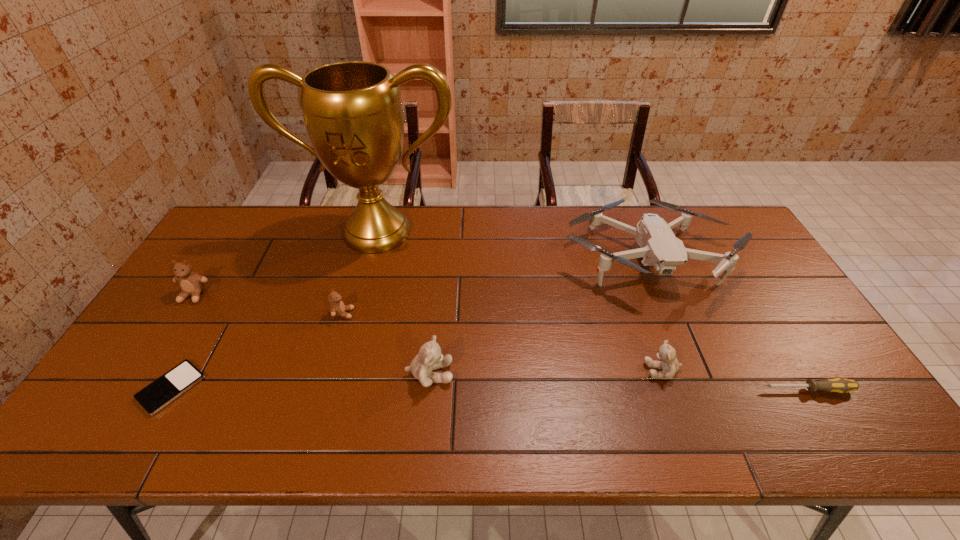
Where is `the smaller gray teddy bear`? The height and width of the screenshot is (540, 960). the smaller gray teddy bear is located at coordinates (667, 354).

Locate an element on the screen. The width and height of the screenshot is (960, 540). gray screwdriver is located at coordinates (840, 385).

Find the location of a particular element. screwdriver is located at coordinates (840, 385).

The image size is (960, 540). Identify the location of iPod. (164, 390).

Image resolution: width=960 pixels, height=540 pixels. I want to click on gray iPod, so click(164, 390).

You are a GUI agent. You are given a task and a screenshot of the screen. Output one action in this format:
    pyautogui.click(x=<x>, y=<y>)
    Task: Click on the free space located 0.080m on the surface of the trophy cup with symbols
    This screenshot has width=960, height=540.
    Given the screenshot: What is the action you would take?
    pyautogui.click(x=366, y=275)

You are a GUI agent. You are given a task and a screenshot of the screen. Output one action in this format:
    pyautogui.click(x=<x>, y=<y>)
    Task: Click on the vacant space situated with a camera at the front of the drone
    
    Given the screenshot: What is the action you would take?
    pyautogui.click(x=707, y=410)

The width and height of the screenshot is (960, 540). In order to click on free space located 0.140m on the front-facing side of the bigger brown teddy bear in this screenshot , I will do `click(162, 343)`.

Locate an element on the screen. The height and width of the screenshot is (540, 960). free space located 0.250m on the face of the left gray teddy bear is located at coordinates (553, 374).

Where is `free region located on the front-facing side of the right brown teddy bear`? This screenshot has height=540, width=960. free region located on the front-facing side of the right brown teddy bear is located at coordinates (445, 314).